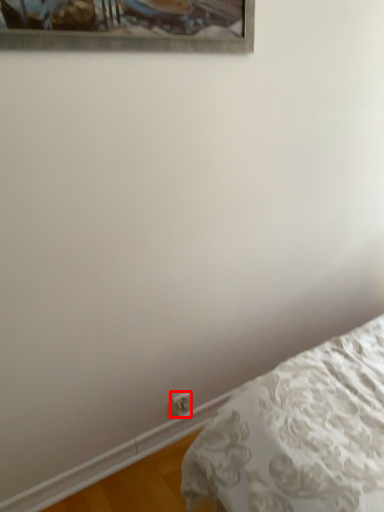
Question: From the image's perspective, where is electric outlet (annotated by the red box) located relative to bed?

Choices:
 (A) above
 (B) below

Answer: (A)